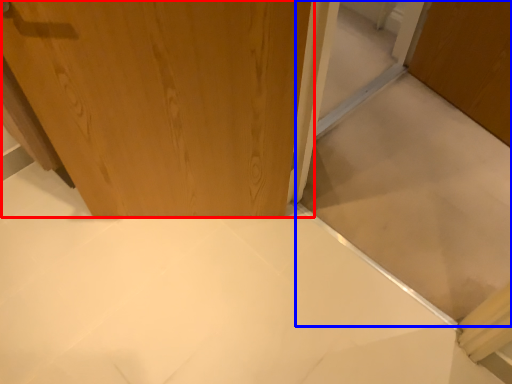
Question: Which of the following is the closest to the observer, door (highlighted by a red box) or cabinetry (highlighted by a blue box)?

Choices:
 (A) door
 (B) cabinetry

Answer: (B)